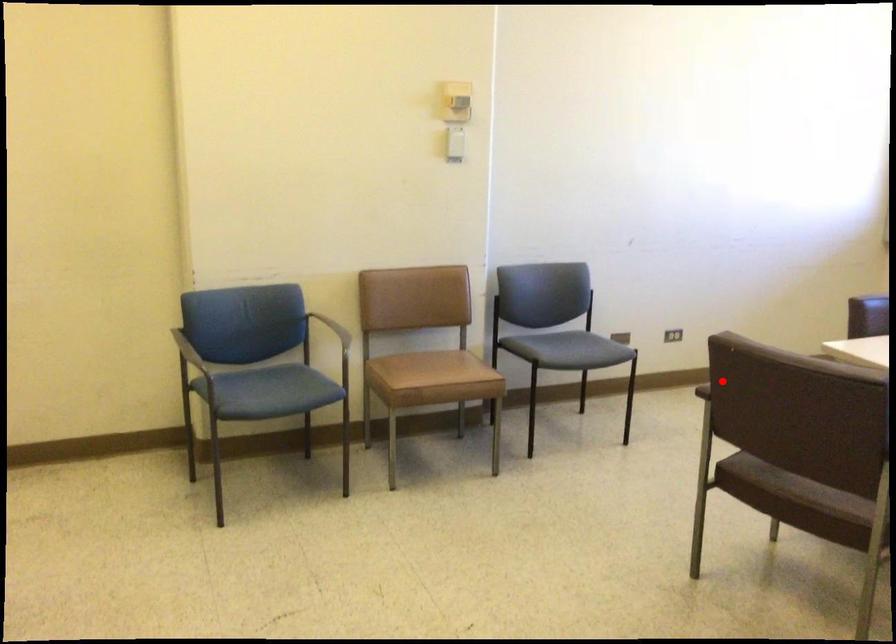
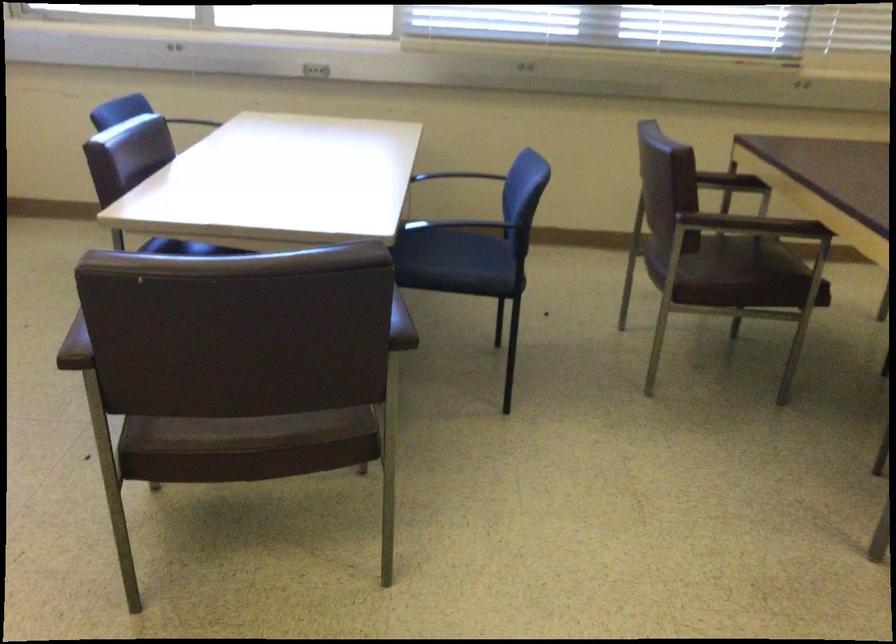
Question: A red point is marked in image1. In image2, is the corresponding 3D point closer to the camera or farther? Reply with the corresponding letter.

Choices:
 (A) The corresponding 3D point is closer.
 (B) The corresponding 3D point is farther.

Answer: (A)